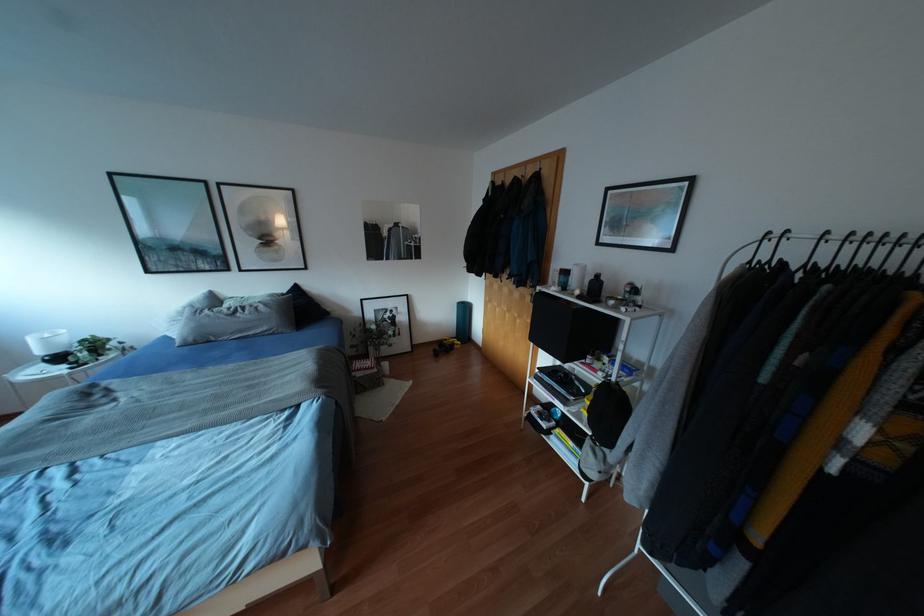
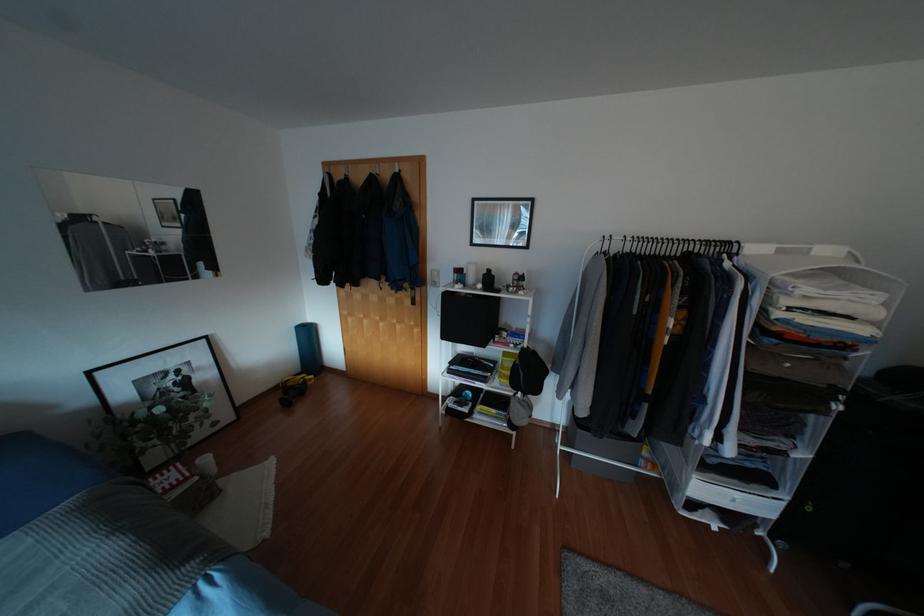
Locate, in the second image, the point that corresponds to point 544,172 in the first image.

(406, 176)